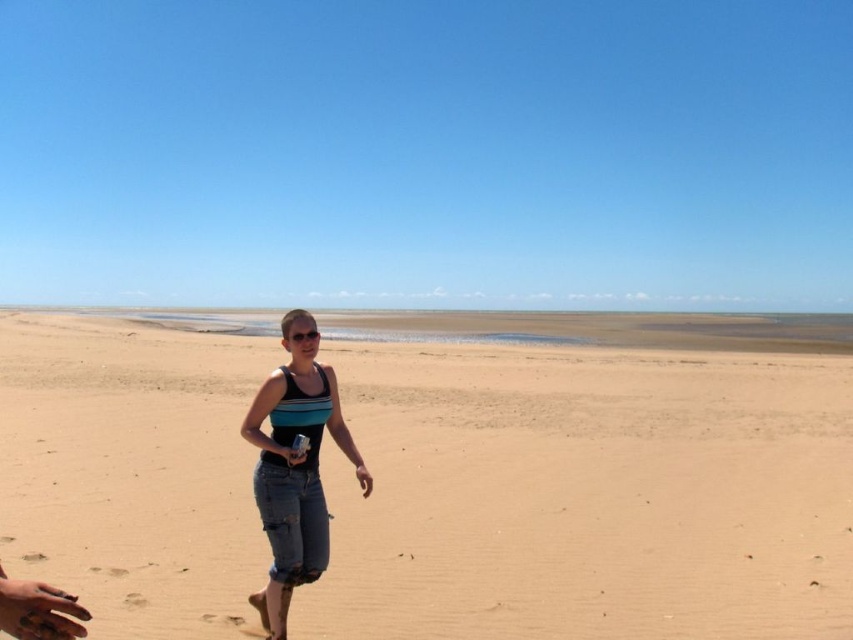
Question: Which of these objects is positioned farthest from the denim shorts at center?

Choices:
 (A) smooth tan skin at lower center
 (B) brown sandy beach at center
 (C) smooth plastic bottle at center

Answer: (B)

Question: Which of the following is the closest to the observer?

Choices:
 (A) (363, 467)
 (B) (279, 579)
 (C) (154, 461)

Answer: (B)

Question: Does brown sandy beach at center appear on the left side of smooth tan skin at lower center?

Choices:
 (A) yes
 (B) no

Answer: (A)

Question: Observing the image, what is the correct spatial positioning of smooth tan skin at lower center in reference to smooth plastic bottle at center?

Choices:
 (A) right
 (B) left

Answer: (A)

Question: Which of the following is the farthest from the observer?

Choices:
 (A) (264, 516)
 (B) (357, 477)
 (C) (73, 602)
 (D) (287, 461)

Answer: (B)

Question: Is brown sandy beach at center further to camera compared to denim shorts at center?

Choices:
 (A) yes
 (B) no

Answer: (A)